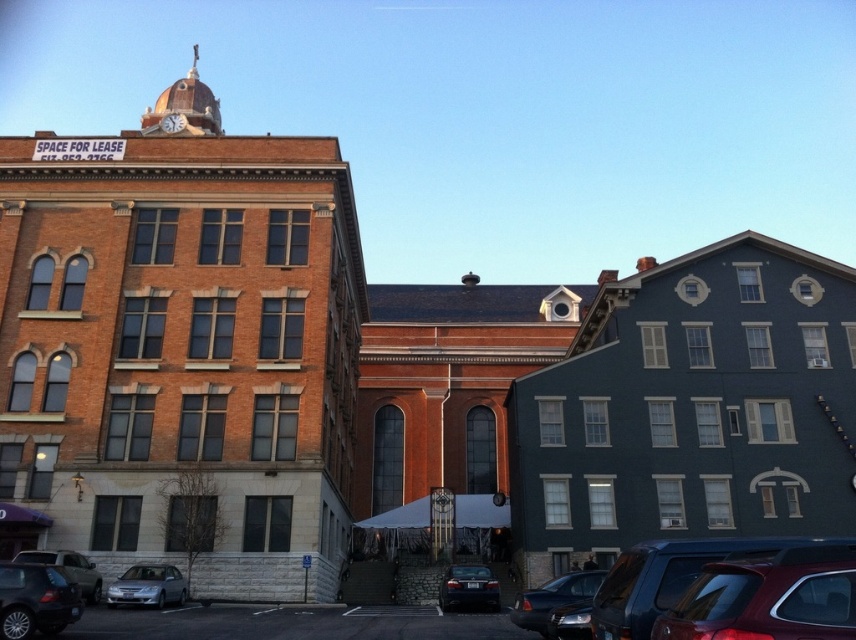
You are a delivery person needing to park your delivery van between the matte black car at lower left and the shiny black sedan at center. The van requires a space of 6 meters in length. Can you fit your van between them?

The matte black car at lower left is larger in size than the shiny black sedan at center, but the exact distance between them is not provided. Without knowing the actual space between the two cars, it is impossible to determine if the van can fit.

You are a delivery driver who needs to park your vehicle between the two buildings. Given that you have a matte black car at lower left and a shiny black sedan at lower right, which one is closer to the building on the left?

The matte black car at lower left is closer to the building on the left because it is positioned to the left of the shiny black sedan at lower right, which is further away from the left building.